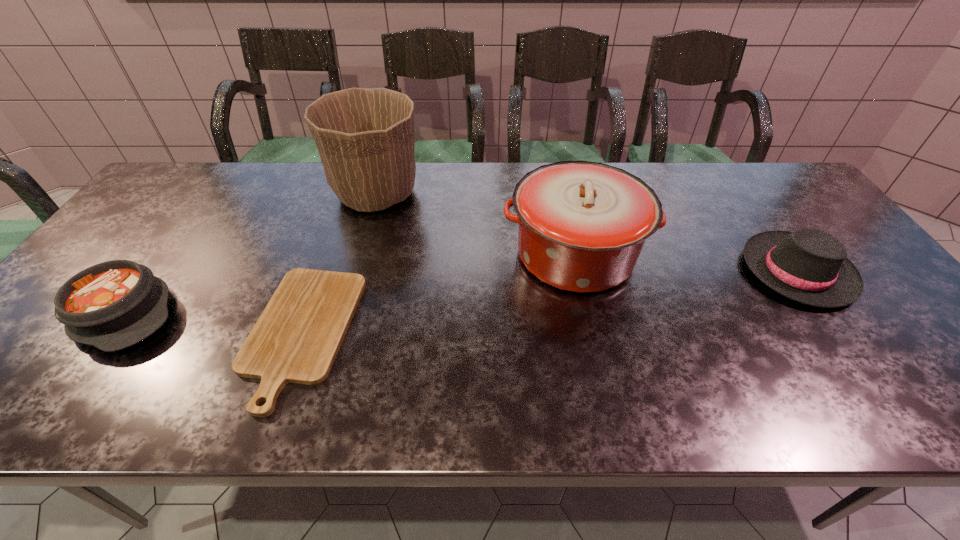
The height and width of the screenshot is (540, 960). I want to click on empty space that is in between the dress hat and the chopping board, so 549,303.

At what (x,y) coordinates should I click in order to perform the action: click on vacant space that's between the shortest object and the left casserole. Please return your answer as a coordinate pair (x, y). The height and width of the screenshot is (540, 960). Looking at the image, I should click on (213, 324).

Find the location of a particular element. free spot between the chopping board and the left casserole is located at coordinates (213, 324).

Identify the location of free space that is in between the shortest object and the dress hat. (549, 303).

Locate an element on the screen. Image resolution: width=960 pixels, height=540 pixels. free space between the chopping board and the dress hat is located at coordinates (549, 303).

This screenshot has height=540, width=960. Identify the location of vacant space that's between the shorter casserole and the shortest object. (213, 324).

This screenshot has height=540, width=960. What are the coordinates of `unoccupied position between the rightmost object and the fourth object from left to right` in the screenshot? It's located at (686, 263).

Locate an element on the screen. This screenshot has width=960, height=540. object that stands as the closest to the shortest object is located at coordinates (112, 305).

Point out which object is positioned as the second nearest to the flowerpot. Please provide its 2D coordinates. Your answer should be formatted as a tuple, i.e. [(x, y)], where the tuple contains the x and y coordinates of a point satisfying the conditions above.

[(582, 225)]

Where is `free space that satisfies the following two spatial constraints: 1. on the back side of the second object from right to left; 2. on the right side of the leftmost object`? The image size is (960, 540). free space that satisfies the following two spatial constraints: 1. on the back side of the second object from right to left; 2. on the right side of the leftmost object is located at coordinates (166, 254).